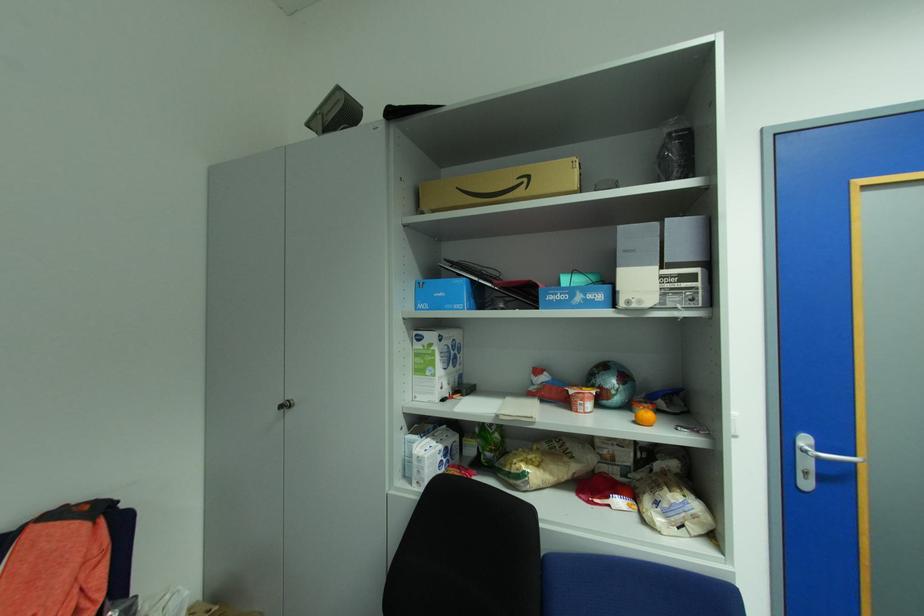
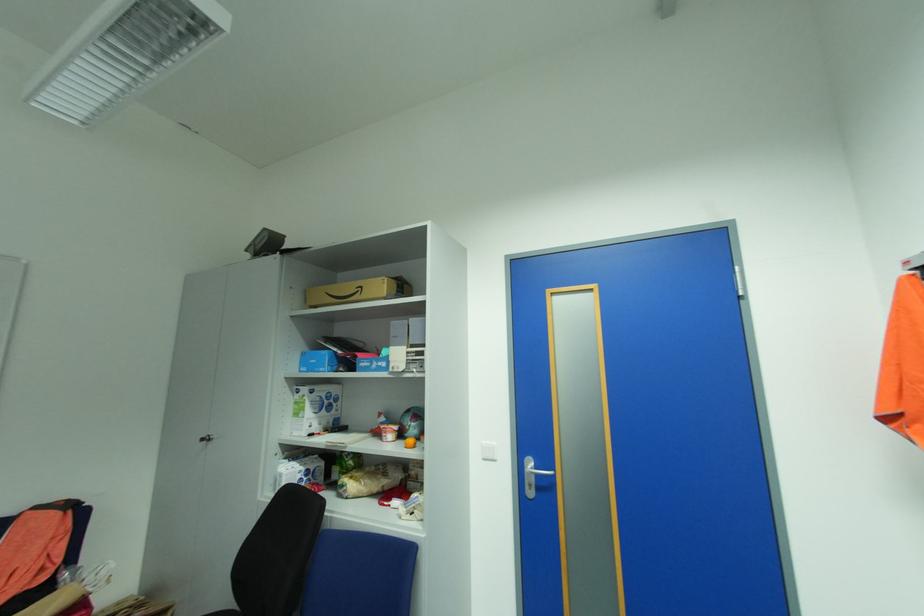
Locate, in the second image, the point that corresponds to (x=830, y=460) in the first image.

(543, 475)